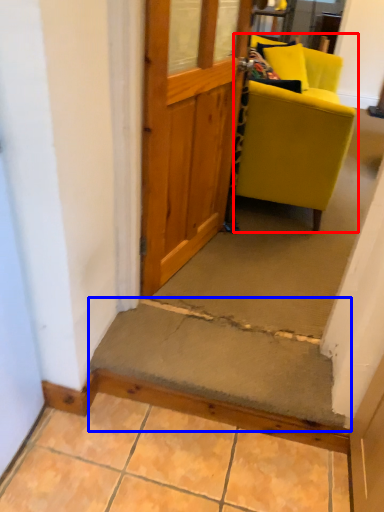
Question: Among these objects, which one is nearest to the camera, chair (highlighted by a red box) or stairwell (highlighted by a blue box)?

Choices:
 (A) chair
 (B) stairwell

Answer: (B)